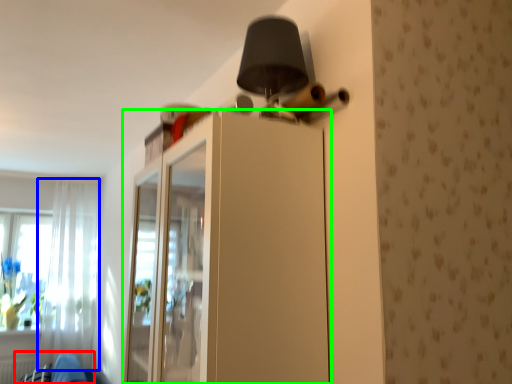
Question: Considering the real-world distances, which object is farthest from swivel chair (highlighted by a red box)? curtain (highlighted by a blue box) or dresser (highlighted by a green box)?

Choices:
 (A) curtain
 (B) dresser

Answer: (B)